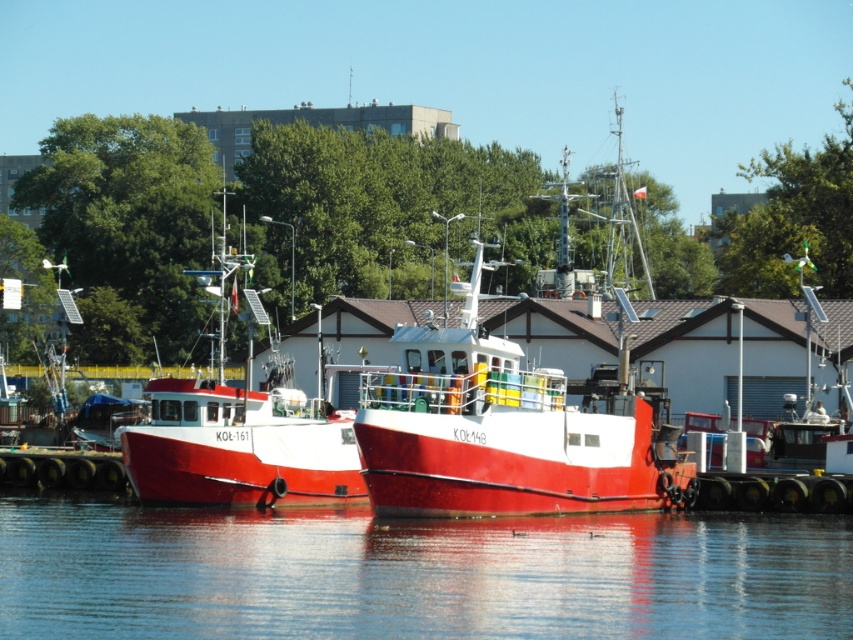
Looking at this image, does transparent water at center appear on the right side of red matte boat at left?

Correct, you'll find transparent water at center to the right of red matte boat at left.

Is point (618, 577) positioned before point (291, 474)?

Yes, point (618, 577) is closer to viewer.

Where is `transparent water at center`? transparent water at center is located at coordinates (416, 573).

Image resolution: width=853 pixels, height=640 pixels. Find the location of `shiny red boat at center`. shiny red boat at center is located at coordinates (506, 432).

What are the coordinates of `shiny red boat at center` in the screenshot? It's located at (506, 432).

Is transparent water at center wider than shiny red boat at center?

Indeed, transparent water at center has a greater width compared to shiny red boat at center.

Who is taller, transparent water at center or shiny red boat at center?

shiny red boat at center is taller.

Image resolution: width=853 pixels, height=640 pixels. Describe the element at coordinates (416, 573) in the screenshot. I see `transparent water at center` at that location.

This screenshot has width=853, height=640. I want to click on transparent water at center, so coord(416,573).